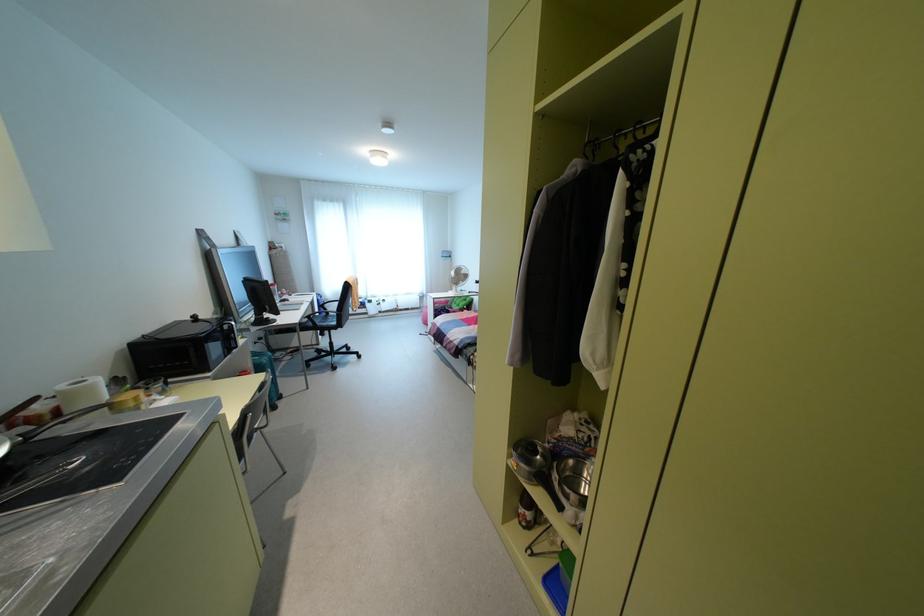
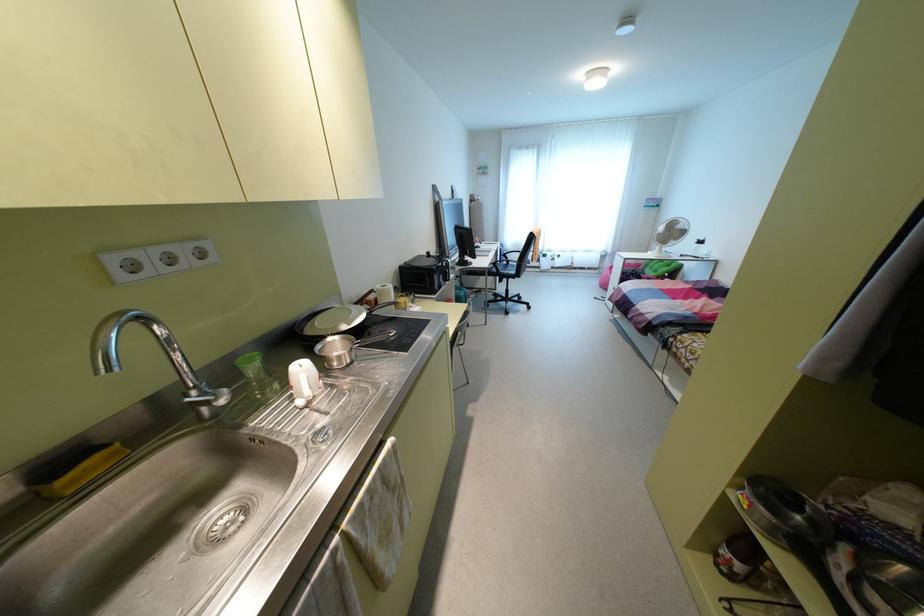
Where in the second image is the point corresponding to (x=87, y=469) from the first image?

(392, 339)